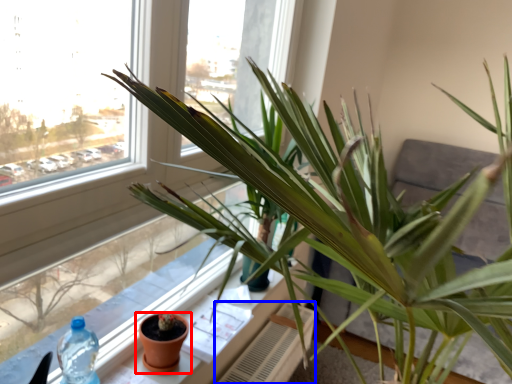
Question: Which of the following is the closest to the observer, flowerpot (highlighted by a red box) or radiator (highlighted by a blue box)?

Choices:
 (A) flowerpot
 (B) radiator

Answer: (A)